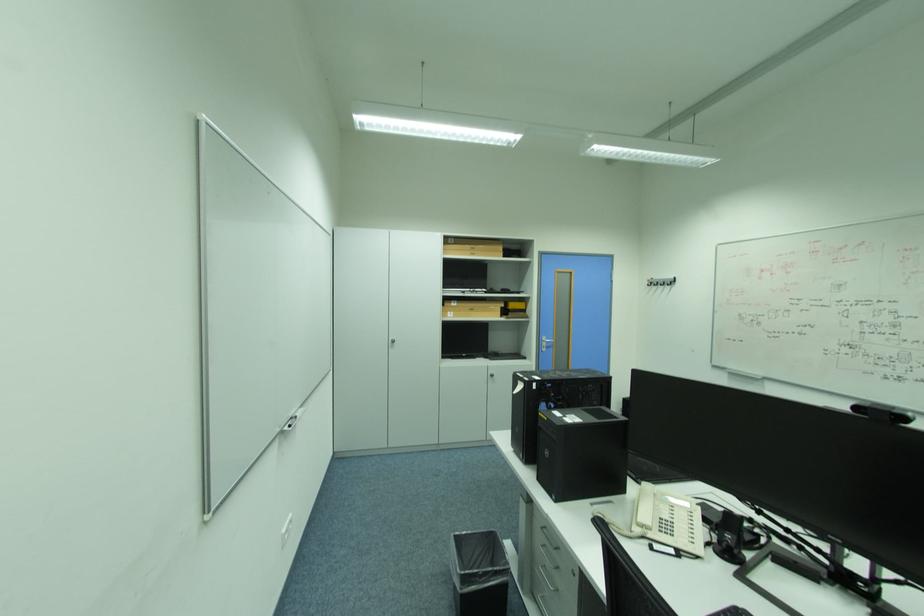
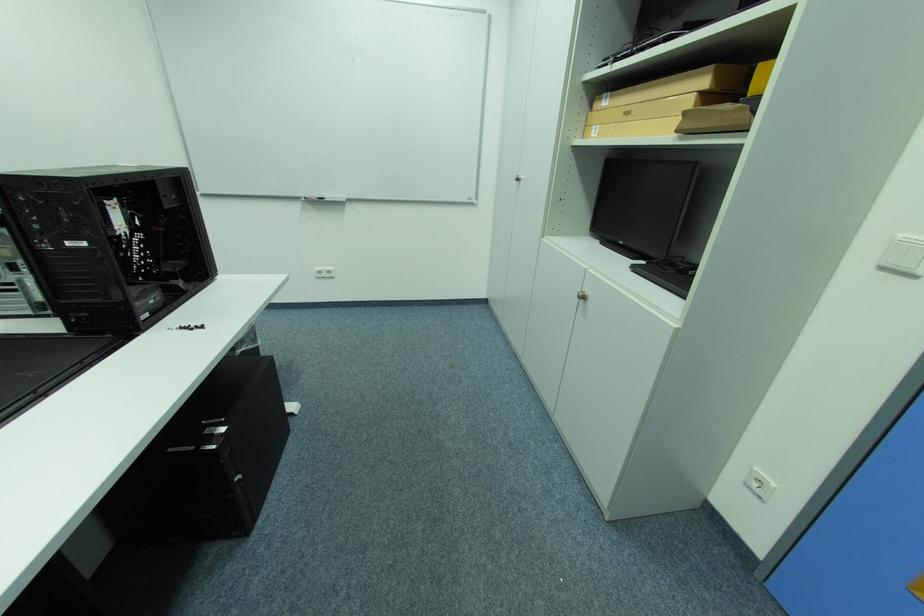
In the second image, find the point that corresponds to (463,302) in the first image.

(614, 98)